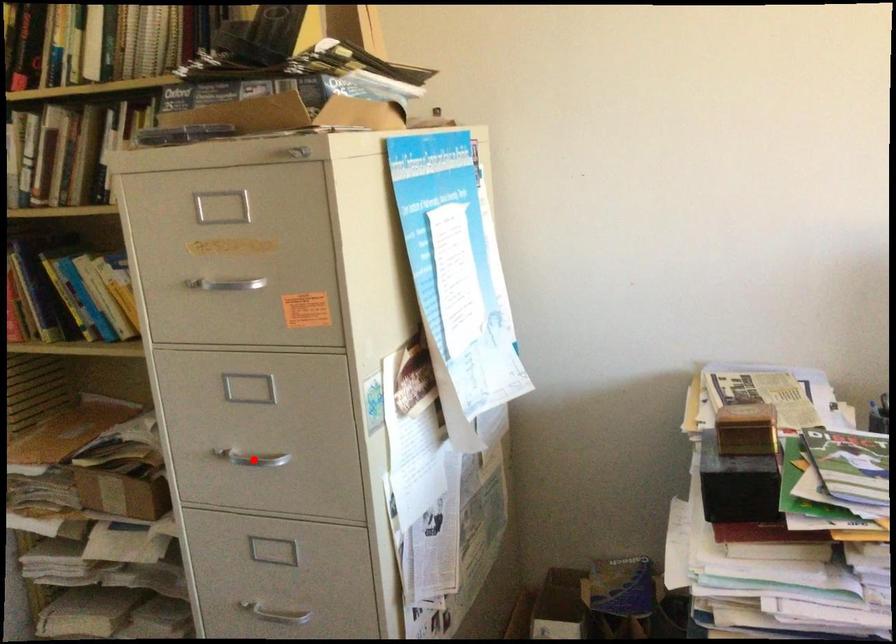
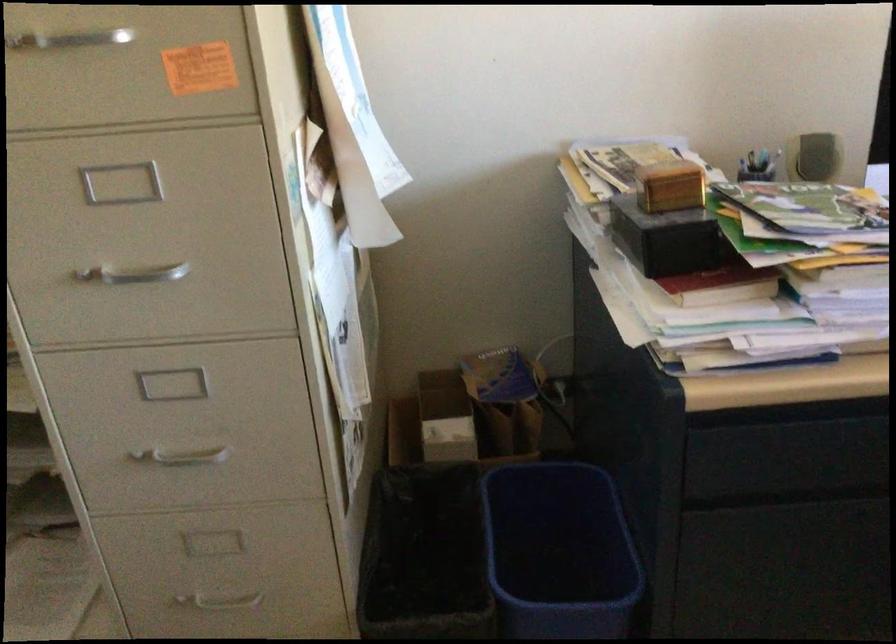
Where in the second image is the point corresponding to the highlighted location from the first image?

(134, 274)